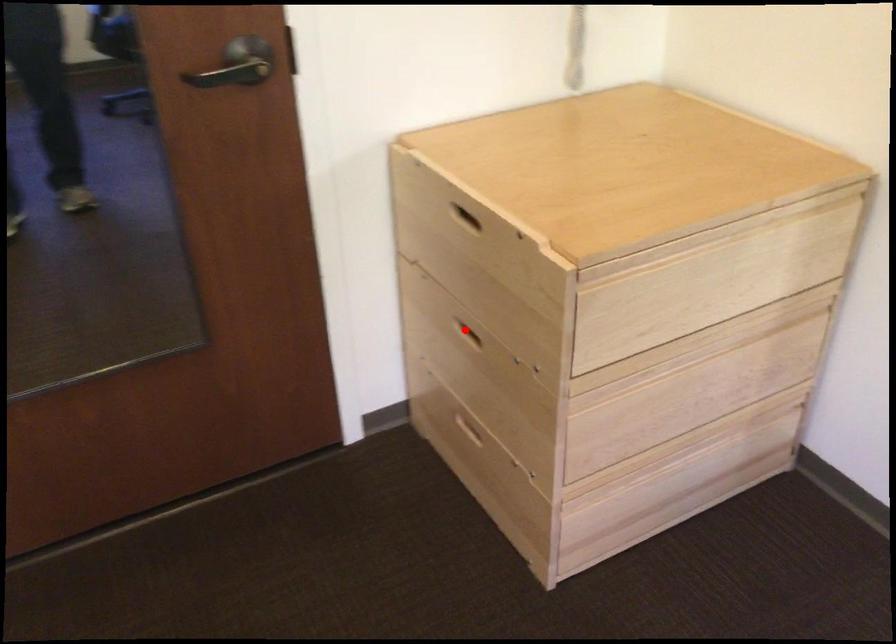
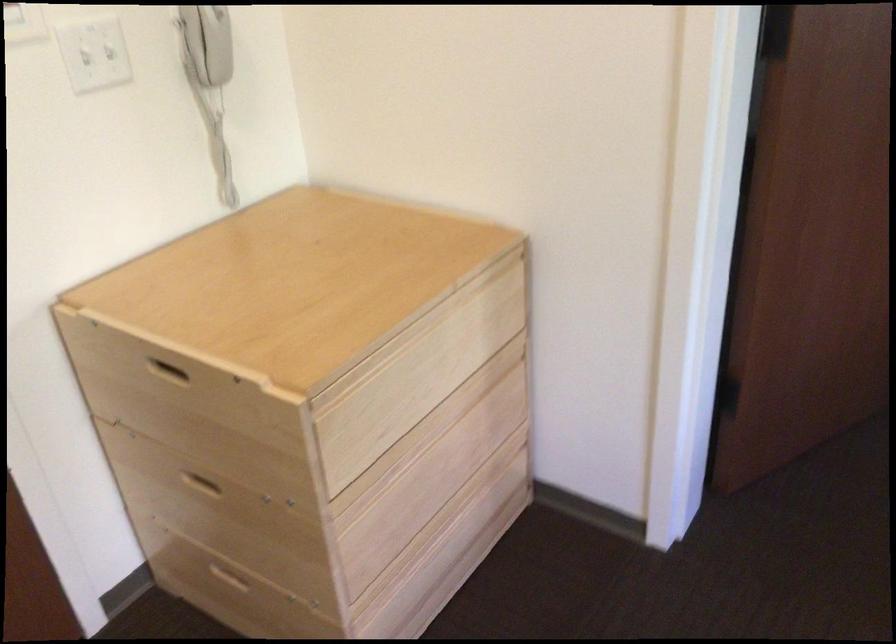
In the second image, find the point that corresponds to the highlighted location in the first image.

(201, 483)